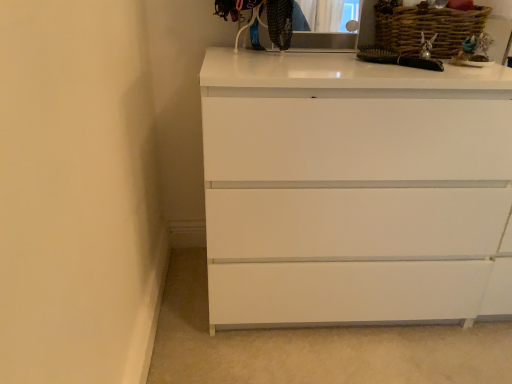
Question: Considering the positions of white glossy chest of drawers at center and woven brown basket at upper right in the image, is white glossy chest of drawers at center wider or thinner than woven brown basket at upper right?

Choices:
 (A) wide
 (B) thin

Answer: (A)

Question: Is point (394, 319) closer or farther from the camera than point (384, 29)?

Choices:
 (A) farther
 (B) closer

Answer: (A)

Question: Estimate the real-world distances between objects in this image. Which object is farther from the white glossy chest of drawers at center?

Choices:
 (A) matte black medicine cabinet at upper center
 (B) woven brown basket at upper right

Answer: (A)

Question: Which object is positioned farthest from the woven brown basket at upper right?

Choices:
 (A) white glossy chest of drawers at center
 (B) matte black medicine cabinet at upper center

Answer: (A)